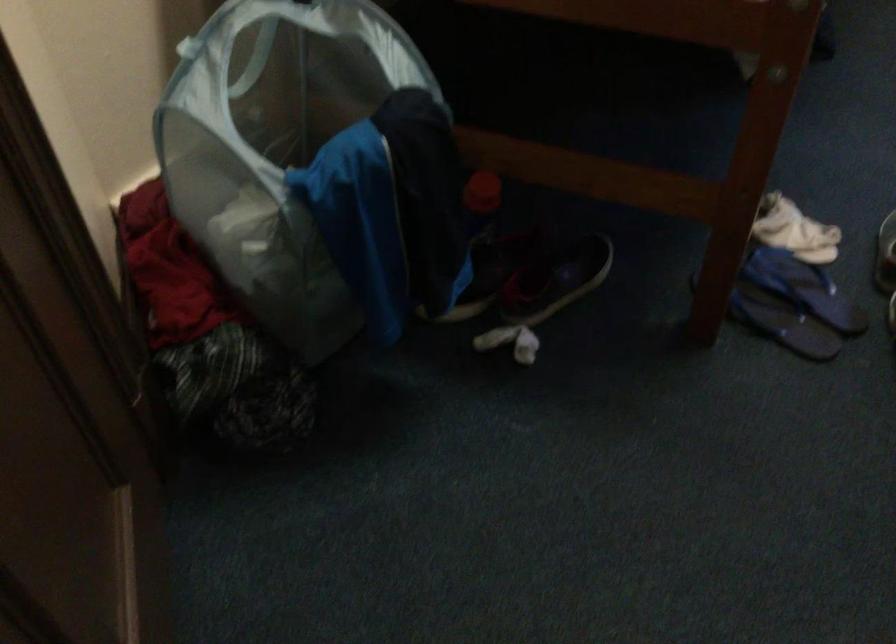
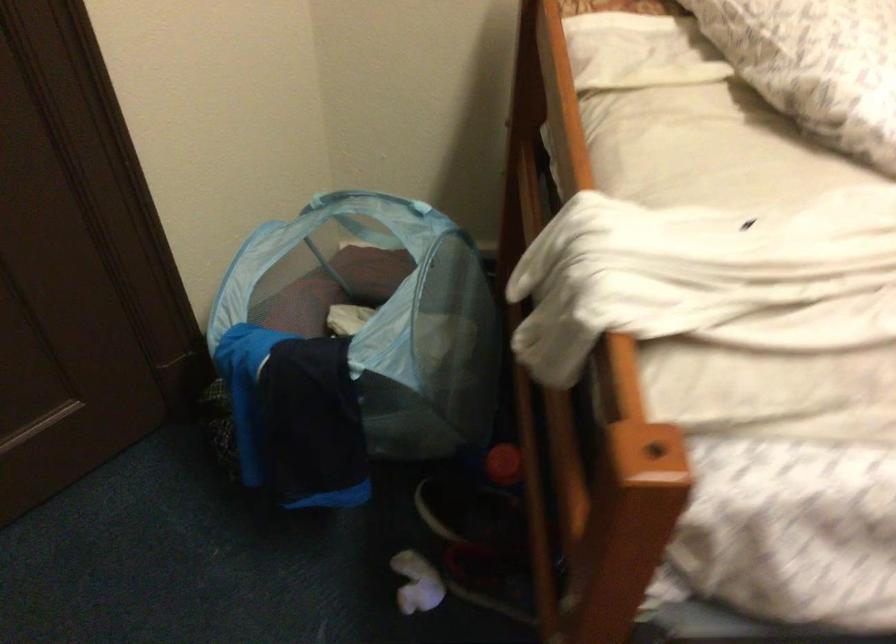
In the second image, find the point that corresponds to the point at 487,182 in the first image.

(504, 464)